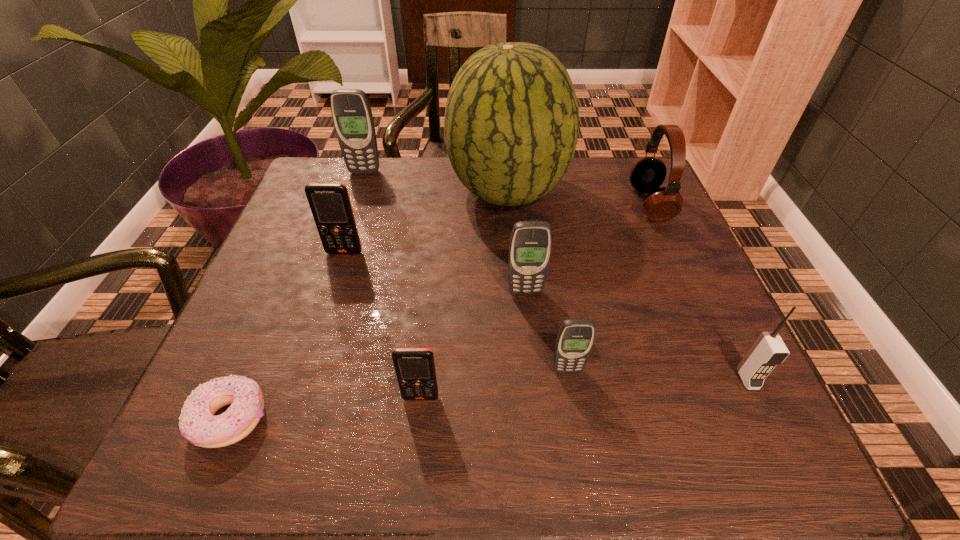
The height and width of the screenshot is (540, 960). Identify the location of vacant region at the near right corner. (757, 431).

Find the location of a particular element. The width and height of the screenshot is (960, 540). empty space between the shortest object and the farthest gray cellular telephone is located at coordinates (298, 295).

At what (x,y) coordinates should I click in order to perform the action: click on vacant space in between the headset and the watermelon. Please return your answer as a coordinate pair (x, y). The height and width of the screenshot is (540, 960). Looking at the image, I should click on (579, 198).

The height and width of the screenshot is (540, 960). Identify the location of free space that is in between the second farthest gray cellular telephone and the fifth nearest cellular telephone. (435, 273).

Identify the location of free space between the farthest gray cellular telephone and the smaller orange cellular telephone. (393, 285).

The image size is (960, 540). Identify the location of vacant area between the headset and the watermelon. (579, 198).

At what (x,y) coordinates should I click in order to perform the action: click on unoccupied position between the rightmost cellular telephone and the tallest object. Please return your answer as a coordinate pair (x, y). The height and width of the screenshot is (540, 960). Looking at the image, I should click on (628, 286).

I want to click on empty location between the left orange cellular telephone and the headset, so click(497, 228).

The image size is (960, 540). In order to click on free space between the black headset and the right orange cellular telephone in this screenshot , I will do `click(536, 300)`.

I want to click on vacant area that lies between the rightmost cellular telephone and the shortest object, so click(x=490, y=399).